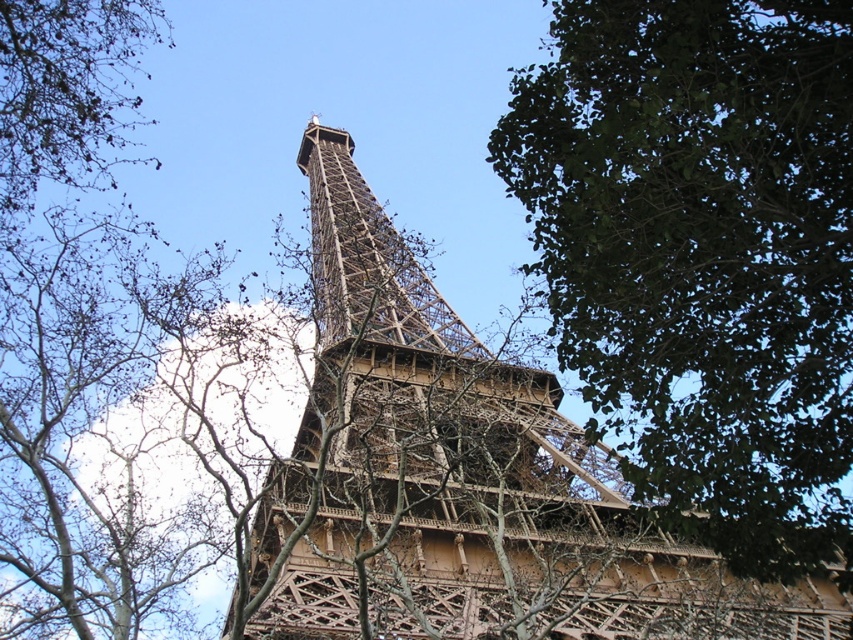
You are standing at the base of the Eiffel Tower and see two points marked in the image. The first point is at coordinates point (x=799, y=140) and the second point is at point (x=479, y=509). Which point is closer to you?

Point (x=799, y=140) is in front of point (x=479, y=509), so the first point is closer to you.

You are standing in front of the Eiffel Tower and want to take a photo that includes both the Eiffel Tower and the green leafy tree at center. Based on their positions, where should you position yourself to ensure both are in the frame?

To include both the Eiffel Tower and the green leafy tree at center in your photo, position yourself so that the green leafy tree at center is located at approximately 40.000 on the horizontal axis and 82.400 on the vertical axis of the frame.